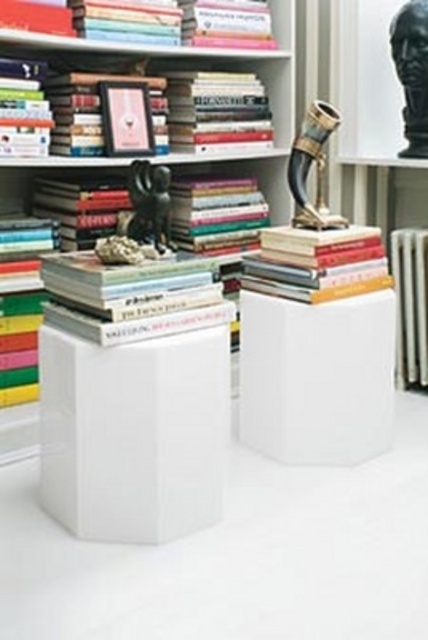
You are standing in front of the bookshelf and want to place a new book between the two points marked as point [258,163] and point [267,280]. Considering their positions, which point should you approach first to ensure the book is placed correctly?

You should approach point [258,163] first because it is closer to you than point [267,280], so placing the book there first ensures proper positioning between them.

What are the coordinates of the hardcover book at upper center?

The hardcover book at upper center is located at coordinates point (59, 24).